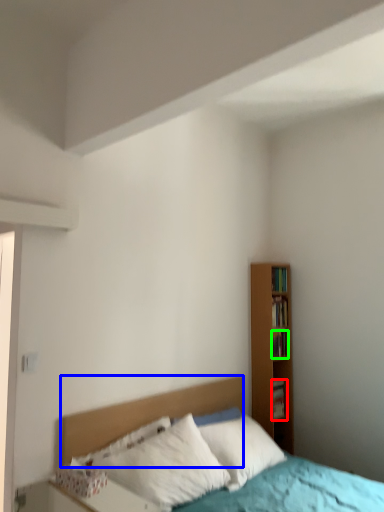
Question: Based on their relative distances, which object is nearer to book (highlighted by a red box)? Choose from headboard (highlighted by a blue box) and book (highlighted by a green box).

Choices:
 (A) headboard
 (B) book

Answer: (B)